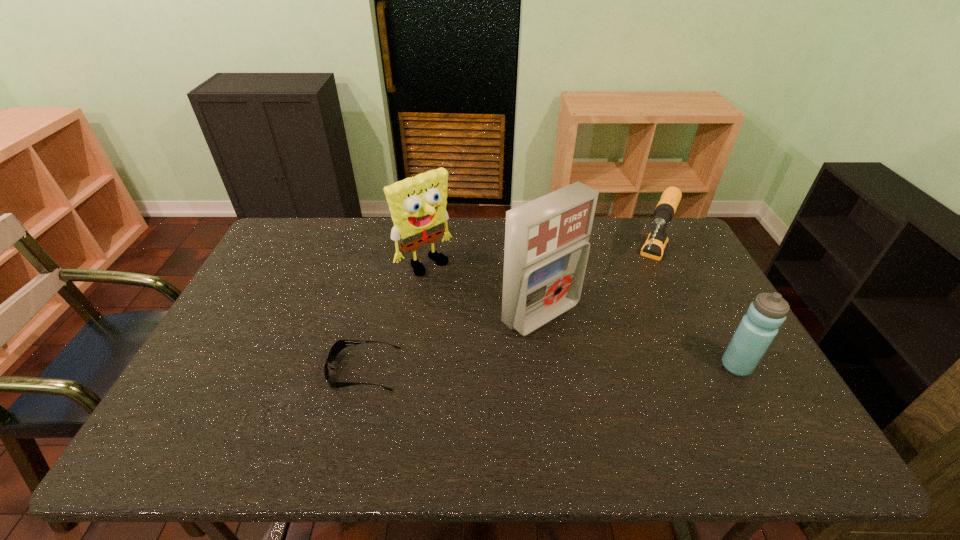
Locate an element on the screen. Image resolution: width=960 pixels, height=540 pixels. the shortest object is located at coordinates (338, 346).

You are a GUI agent. You are given a task and a screenshot of the screen. Output one action in this format:
    pyautogui.click(x=<x>, y=<y>)
    Task: Click on the water bottle
    
    Given the screenshot: What is the action you would take?
    click(757, 329)

Locate an element on the screen. This screenshot has height=540, width=960. the fourth shortest object is located at coordinates (417, 204).

This screenshot has height=540, width=960. What are the coordinates of `the third object from right to left` in the screenshot? It's located at (547, 246).

Where is `the first-aid kit`? This screenshot has width=960, height=540. the first-aid kit is located at coordinates (547, 246).

You are a GUI agent. You are given a task and a screenshot of the screen. Output one action in this format:
    pyautogui.click(x=<x>, y=<y>)
    Task: Click on the second shortest object
    
    Given the screenshot: What is the action you would take?
    pyautogui.click(x=655, y=245)

You are a GUI agent. You are given a task and a screenshot of the screen. Output one action in this format:
    pyautogui.click(x=<x>, y=<y>)
    Task: Click on the vacant region located on the front-facing side of the sunglasses
    The width and height of the screenshot is (960, 540).
    Given the screenshot: What is the action you would take?
    pyautogui.click(x=310, y=369)

The height and width of the screenshot is (540, 960). I want to click on free space located on the front-facing side of the sunglasses, so click(x=286, y=369).

This screenshot has width=960, height=540. Identify the location of vacant area located on the front-facing side of the sunglasses. (255, 369).

I want to click on free space located 0.360m on the left of the third shortest object, so click(582, 366).